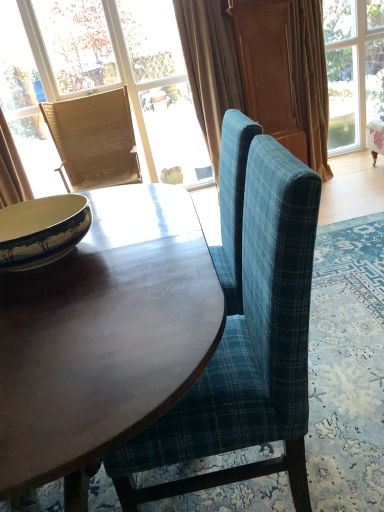
The width and height of the screenshot is (384, 512). I want to click on empty space that is to the right of blue plaid fabric chair at center, positioned as the first chair in right-to-left order, so click(x=346, y=419).